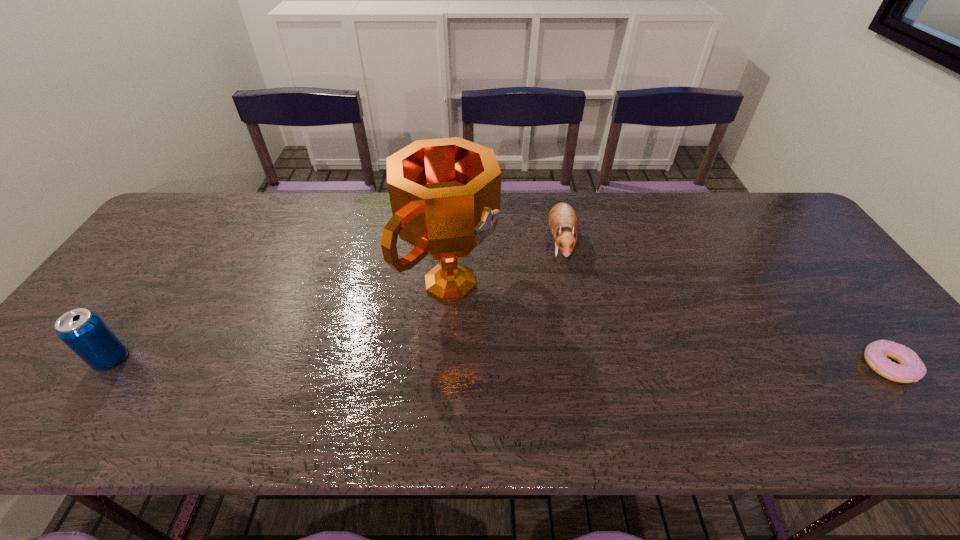
This screenshot has width=960, height=540. Identify the location of vacant point that satisfies the following two spatial constraints: 1. on the back side of the pop soda; 2. on the left side of the award. (165, 283).

You are a GUI agent. You are given a task and a screenshot of the screen. Output one action in this format:
    pyautogui.click(x=<x>, y=<y>)
    Task: Click on the vacant region that satisfies the following two spatial constraints: 1. on the back side of the third shortest object; 2. on the left side of the second object from right to left
    
    Given the screenshot: What is the action you would take?
    pyautogui.click(x=194, y=242)

This screenshot has width=960, height=540. In order to click on free location that satisfies the following two spatial constraints: 1. on the front side of the doughnut; 2. on the left side of the tallest object in this screenshot , I will do `click(445, 366)`.

The image size is (960, 540). Identify the location of free space that satisfies the following two spatial constraints: 1. on the front side of the second object from left to right; 2. on the left side of the rightmost object. (445, 366).